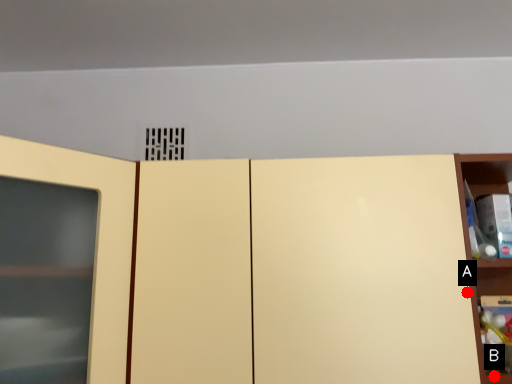
Question: Two points are circled on the image, labeled by A and B beside each circle. Which point appears farthest from the camera in this image?

Choices:
 (A) A is further
 (B) B is further

Answer: (B)